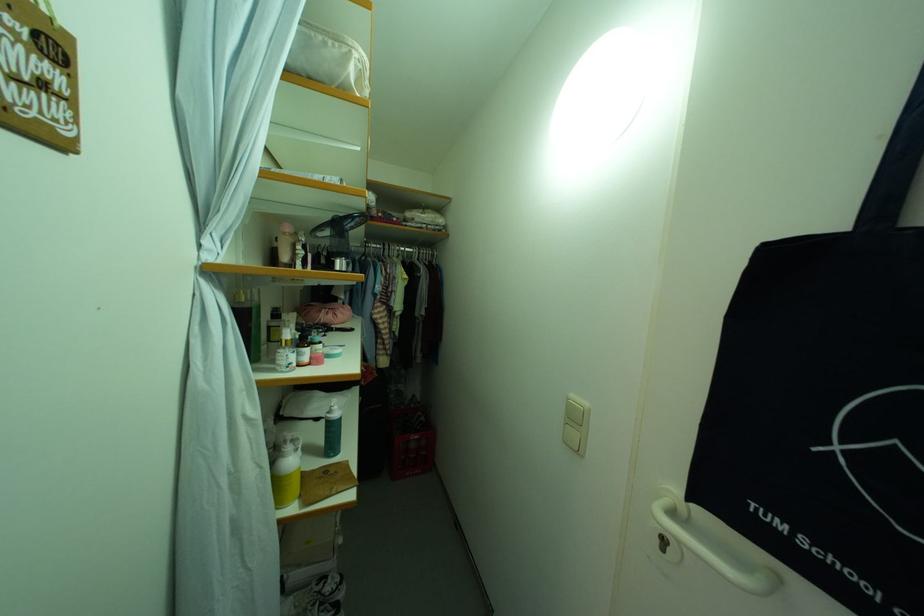
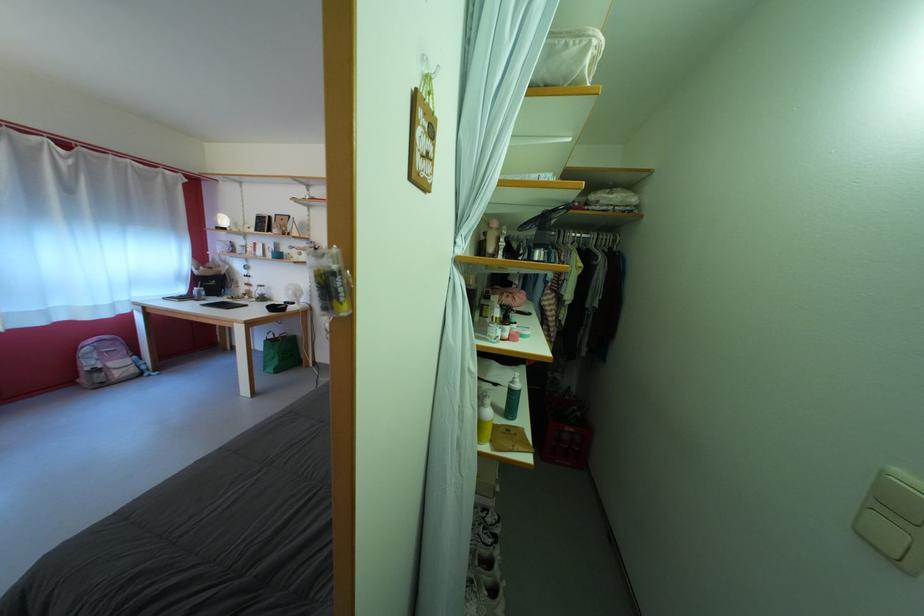
Question: The camera is either moving clockwise (left) or counter-clockwise (right) around the object. The first image is from the beginning of the video and the second image is from the end. Is the camera moving left or right when shooting the video?

Choices:
 (A) Left
 (B) Right

Answer: (B)